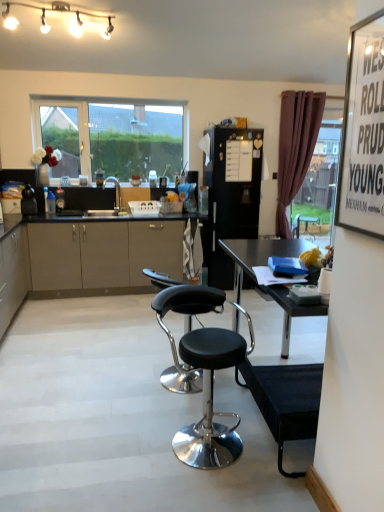
Question: Does black matte refrigerator at center, which appears as the first appliance when viewed from the back, have a greater width compared to matte beige cabinet at lower left?

Choices:
 (A) no
 (B) yes

Answer: (B)

Question: From the image's perspective, does black matte refrigerator at center, the first appliance when ordered from right to left, appear higher than matte beige cabinet at lower left?

Choices:
 (A) yes
 (B) no

Answer: (A)

Question: Does black matte refrigerator at center, the 2th appliance viewed from the left, have a smaller size compared to matte beige cabinet at lower left?

Choices:
 (A) no
 (B) yes

Answer: (B)

Question: Considering the relative sizes of black matte refrigerator at center, the 2th appliance viewed from the left, and matte beige cabinet at lower left in the image provided, is black matte refrigerator at center, the 2th appliance viewed from the left, bigger than matte beige cabinet at lower left?

Choices:
 (A) no
 (B) yes

Answer: (A)

Question: Does black matte refrigerator at center, the first appliance when ordered from right to left, appear on the left side of matte beige cabinet at lower left?

Choices:
 (A) yes
 (B) no

Answer: (B)

Question: Is black matte refrigerator at center, the second appliance when ordered from front to back, surrounding matte beige cabinet at lower left?

Choices:
 (A) yes
 (B) no

Answer: (B)

Question: From a real-world perspective, does white paperboard at upper right sit lower than black plastic camera at left, which appears as the second appliance when viewed from the right?

Choices:
 (A) no
 (B) yes

Answer: (A)

Question: Is white paperboard at upper right in contact with black plastic camera at left, acting as the second appliance starting from the back?

Choices:
 (A) yes
 (B) no

Answer: (B)

Question: Can you confirm if white paperboard at upper right is wider than black plastic camera at left, which appears as the second appliance when viewed from the right?

Choices:
 (A) yes
 (B) no

Answer: (B)

Question: Is white paperboard at upper right looking in the opposite direction of black plastic camera at left, arranged as the 1th appliance when viewed from the front?

Choices:
 (A) no
 (B) yes

Answer: (A)

Question: Can you confirm if white paperboard at upper right is shorter than black plastic camera at left, which appears as the second appliance when viewed from the right?

Choices:
 (A) no
 (B) yes

Answer: (A)

Question: Would you consider white paperboard at upper right to be distant from black plastic camera at left, which is counted as the 1th appliance, starting from the left?

Choices:
 (A) no
 (B) yes

Answer: (B)

Question: From a real-world perspective, does matte beige cabinet at lower left stand above clear glass window at upper center?

Choices:
 (A) no
 (B) yes

Answer: (A)